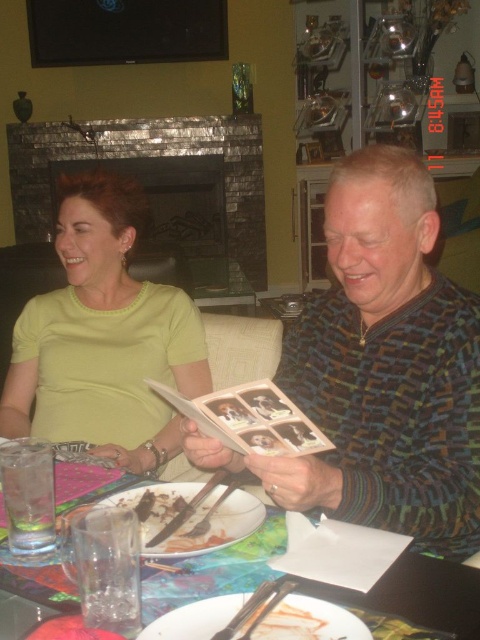
Who is more forward, (327, 356) or (267, 388)?

Positioned in front is point (267, 388).

Is multicolored sweater at center to the right of beige paper book at center from the viewer's perspective?

Indeed, multicolored sweater at center is positioned on the right side of beige paper book at center.

Find the location of `multicolored sweater at center`. multicolored sweater at center is located at coordinates (385, 368).

Is multicolored sweater at center to the left of lime green shirt at center from the viewer's perspective?

In fact, multicolored sweater at center is to the right of lime green shirt at center.

Which is more to the right, multicolored sweater at center or lime green shirt at center?

From the viewer's perspective, multicolored sweater at center appears more on the right side.

Is point (382, 436) positioned in front of point (166, 340)?

Yes, point (382, 436) is in front of point (166, 340).

Identify the location of multicolored sweater at center. click(x=385, y=368).

Looking at this image, who is taller, plastic table at center or dark brown cake at lower center?

With more height is plastic table at center.

Does plastic table at center have a lesser width compared to dark brown cake at lower center?

No.

Is point (444, 630) positioned before point (229, 525)?

That is True.

Identify the location of plastic table at center. (215, 570).